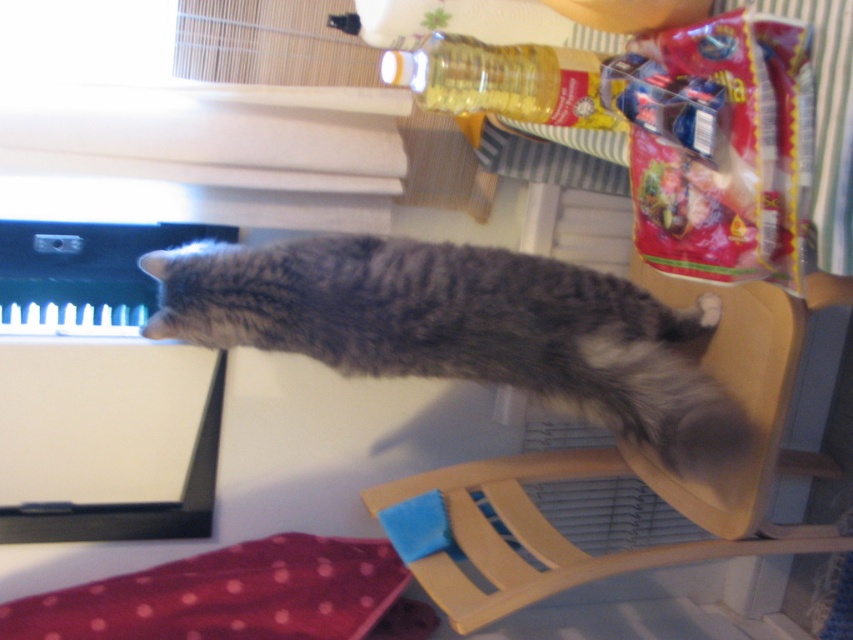
Question: Among these objects, which one is nearest to the camera?

Choices:
 (A) wooden chair at upper right
 (B) gray fluffy cat at center
 (C) translucent plastic bottle at upper center

Answer: (C)

Question: Estimate the real-world distances between objects in this image. Which object is farther from the wooden chair at upper right?

Choices:
 (A) translucent plastic bottle at upper center
 (B) gray fluffy cat at center

Answer: (A)

Question: Is gray fluffy cat at center thinner than wooden chair at upper right?

Choices:
 (A) no
 (B) yes

Answer: (A)

Question: Which of the following is the farthest from the observer?

Choices:
 (A) translucent plastic bottle at upper center
 (B) gray fluffy cat at center

Answer: (B)

Question: Does gray fluffy cat at center appear over wooden chair at upper right?

Choices:
 (A) yes
 (B) no

Answer: (A)

Question: Can you confirm if gray fluffy cat at center is positioned above wooden chair at upper right?

Choices:
 (A) no
 (B) yes

Answer: (B)